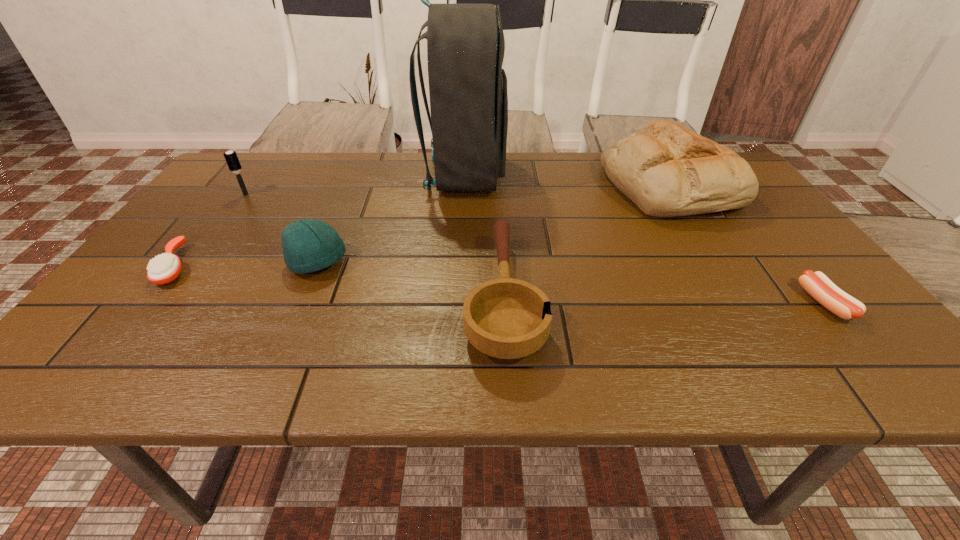
You are a GUI agent. You are given a task and a screenshot of the screen. Output one action in this format:
    pyautogui.click(x=<x>, y=<y>)
    Task: Click on the tallest object
    The width and height of the screenshot is (960, 540).
    Given the screenshot: What is the action you would take?
    pyautogui.click(x=465, y=42)

Locate an element on the screen. The width and height of the screenshot is (960, 540). bread is located at coordinates (666, 170).

The width and height of the screenshot is (960, 540). I want to click on the taller hairbrush, so click(x=231, y=158).

Find the location of a particular element. Image resolution: width=960 pixels, height=540 pixels. the farther hairbrush is located at coordinates (231, 158).

At what (x,y) coordinates should I click in order to perform the action: click on the fourth tallest object. Please return your answer as a coordinate pair (x, y). The height and width of the screenshot is (540, 960). Looking at the image, I should click on (308, 245).

Locate an element on the screen. The height and width of the screenshot is (540, 960). the third object from left to right is located at coordinates (308, 245).

Identify the location of the fifth tallest object. The width and height of the screenshot is (960, 540). (506, 318).

Locate an element on the screen. The image size is (960, 540). the shorter hairbrush is located at coordinates (164, 268).

This screenshot has height=540, width=960. I want to click on sausage, so click(x=818, y=285).

Where is `vacant region located 0.290m on the front-facing side of the backpack`? The width and height of the screenshot is (960, 540). vacant region located 0.290m on the front-facing side of the backpack is located at coordinates (600, 175).